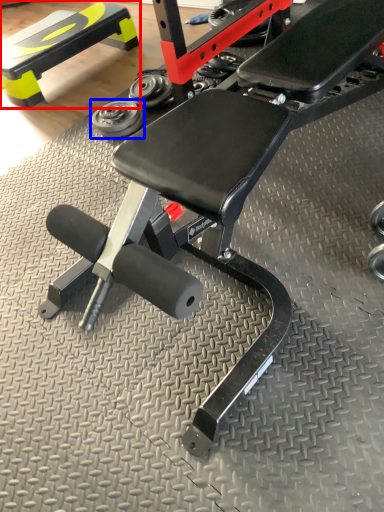
Question: Which object is closer to the camera taking this photo, bench (highlighted by a red box) or dumbbell (highlighted by a blue box)?

Choices:
 (A) bench
 (B) dumbbell

Answer: (B)